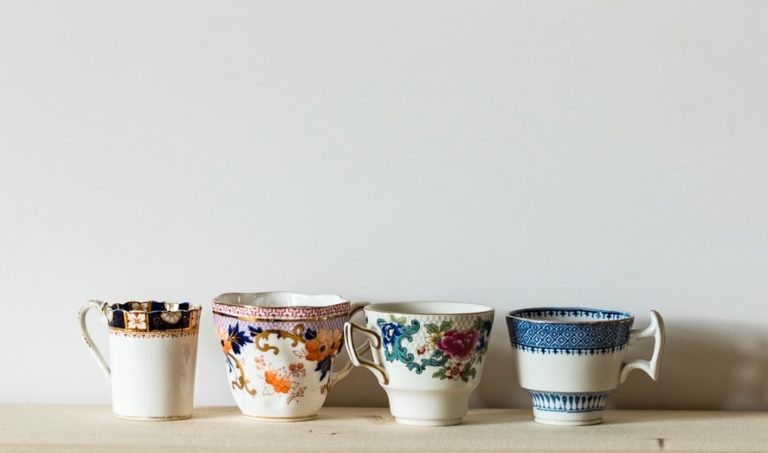
Locate an element on the screen. This screenshot has height=453, width=768. teacups is located at coordinates (167, 309), (273, 342), (449, 361), (545, 364).